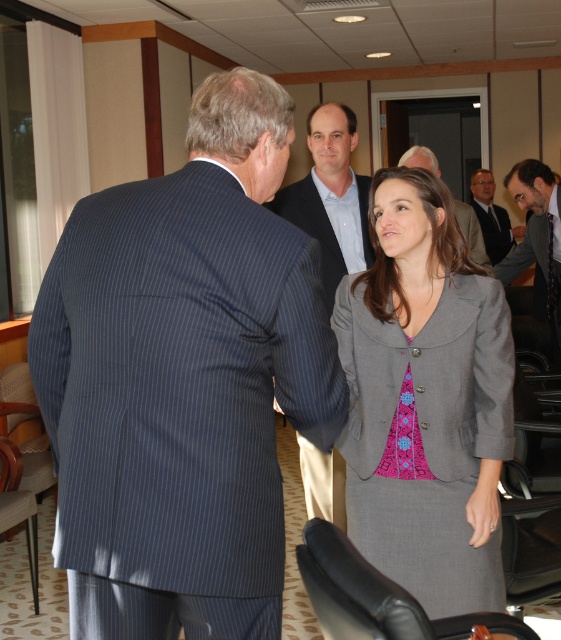
Question: Does gray suit at right have a lesser width compared to gray fabric suit at center?

Choices:
 (A) no
 (B) yes

Answer: (A)

Question: Is gray fabric jacket at center positioned in front of gray suit at center?

Choices:
 (A) yes
 (B) no

Answer: (A)

Question: Which of these objects is positioned closest to the dark gray suit at center?

Choices:
 (A) dark blue pinstripe suit at left
 (B) gray suit at right
 (C) blue pinstripe suit at center

Answer: (B)

Question: Which point is farther to the camera?

Choices:
 (A) gray fabric jacket at center
 (B) dark blue pinstripe suit at left
 (C) gray suit at center
 (D) gray fabric suit at center

Answer: (C)

Question: Is gray suit at right above gray fabric suit at center?

Choices:
 (A) yes
 (B) no

Answer: (B)

Question: Among these points, which one is farthest from the camera?

Choices:
 (A) (413, 157)
 (B) (471, 204)
 (C) (94, 413)
 (D) (532, 225)

Answer: (B)